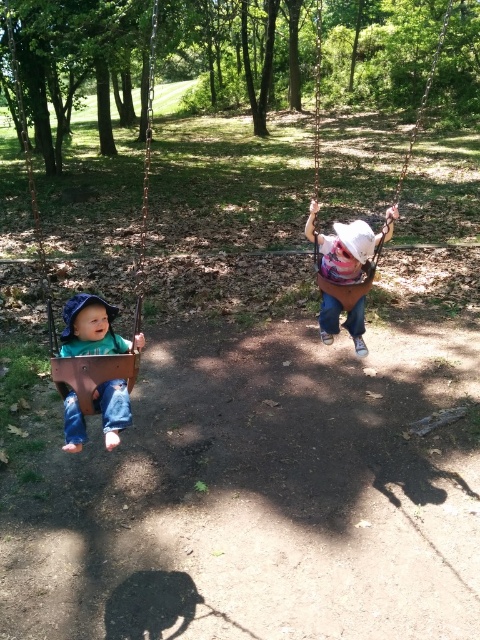
Who is more forward, (x=72, y=342) or (x=340, y=292)?

Point (x=72, y=342) is more forward.

Is point (103, 307) in front of point (324, 284)?

Yes, point (103, 307) is in front of point (324, 284).

In order to click on matte green shirt at left in this screenshot , I will do `click(93, 330)`.

Is denim jeans at center shorter than brown leather swing at upper right?

Yes.

Which is behind, point (338, 224) or point (314, 145)?

The point (314, 145) is more distant.

Who is more distant from viewer, [312,202] or [316,172]?

Point [316,172]

Find the location of a particular element. denim jeans at center is located at coordinates (347, 273).

Which of these two, rusty metal swing at left or matte green shirt at left, stands taller?

rusty metal swing at left

Does rusty metal swing at left have a lesser width compared to matte green shirt at left?

Incorrect, rusty metal swing at left's width is not less than matte green shirt at left's.

Between point (14, 64) and point (93, 323), which one is positioned in front?

Positioned in front is point (93, 323).

Image resolution: width=480 pixels, height=640 pixels. In order to click on rusty metal swing at left in this screenshot , I will do `click(47, 269)`.